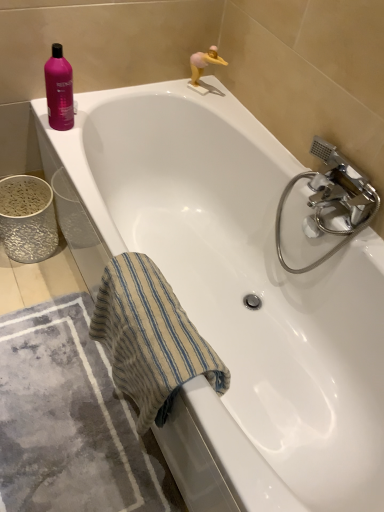
Question: Is pink matte figurine at upper right taller than beige striped towel at lower left?

Choices:
 (A) no
 (B) yes

Answer: (A)

Question: From the image's perspective, is pink matte figurine at upper right on top of beige striped towel at lower left?

Choices:
 (A) yes
 (B) no

Answer: (A)

Question: Does pink matte figurine at upper right turn towards beige striped towel at lower left?

Choices:
 (A) yes
 (B) no

Answer: (B)

Question: Is pink matte figurine at upper right wider than beige striped towel at lower left?

Choices:
 (A) yes
 (B) no

Answer: (B)

Question: Does pink matte figurine at upper right come behind beige striped towel at lower left?

Choices:
 (A) no
 (B) yes

Answer: (B)

Question: Considering the positions of point (56, 48) and point (155, 412), is point (56, 48) closer or farther from the camera than point (155, 412)?

Choices:
 (A) farther
 (B) closer

Answer: (A)

Question: From the image's perspective, is pink glossy shampoo at upper left above or below beige striped towel at lower left?

Choices:
 (A) below
 (B) above

Answer: (B)

Question: From their relative heights in the image, would you say pink glossy shampoo at upper left is taller or shorter than beige striped towel at lower left?

Choices:
 (A) short
 (B) tall

Answer: (A)

Question: Do you think pink glossy shampoo at upper left is within beige striped towel at lower left, or outside of it?

Choices:
 (A) inside
 (B) outside

Answer: (B)

Question: In terms of size, does pink matte figurine at upper right appear bigger or smaller than gray textured bath mat at lower left?

Choices:
 (A) big
 (B) small

Answer: (B)

Question: Relative to gray textured bath mat at lower left, is pink matte figurine at upper right in front or behind?

Choices:
 (A) behind
 (B) front

Answer: (A)

Question: From the image's perspective, relative to gray textured bath mat at lower left, is pink matte figurine at upper right above or below?

Choices:
 (A) below
 (B) above

Answer: (B)

Question: Considering the positions of point (210, 61) and point (127, 428), is point (210, 61) closer or farther from the camera than point (127, 428)?

Choices:
 (A) closer
 (B) farther

Answer: (B)

Question: Is beige striped towel at lower left situated inside pink glossy shampoo at upper left or outside?

Choices:
 (A) inside
 (B) outside

Answer: (B)

Question: Considering the positions of point (153, 353) and point (59, 96), is point (153, 353) closer or farther from the camera than point (59, 96)?

Choices:
 (A) closer
 (B) farther

Answer: (A)